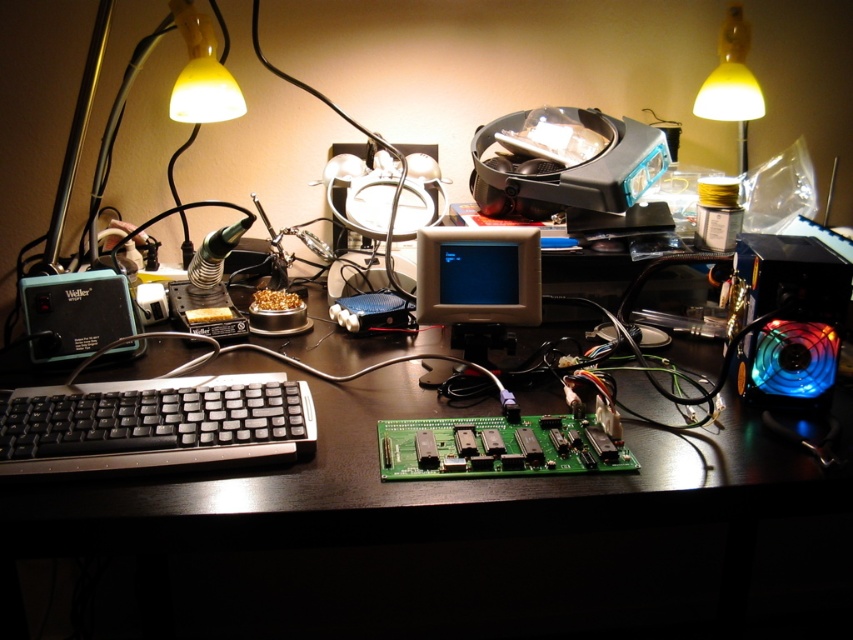
You are looking at the workspace setup. There are two points marked on the desk surface. The first point is at coordinates point (229, 417) and the second point is at point (495, 234). Which point is closer to you?

Point (229, 417) is closer to the camera than point (495, 234).

You are a technician working on this desk and need to access the matte plastic monitor at center. Can you reach it without moving the black plastic keyboard at lower left?

The black plastic keyboard at lower left is in front of the matte plastic monitor at center, so you would need to move the keyboard to access the monitor.

You are organizing the desk and want to stack the black plastic keyboard at lower left on top of the matte plastic monitor at center. Is this possible based on their heights?

The black plastic keyboard at lower left is not as tall as the matte plastic monitor at center, so it can be stacked on top since it is shorter.